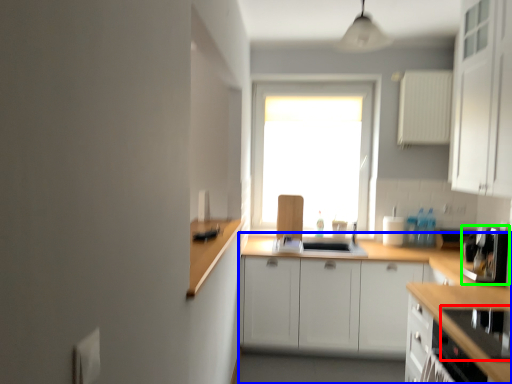
Question: Based on their relative distances, which object is farther from appliance (highlighted by a red box)? Choose from countertop (highlighted by a blue box) and coffee machine (highlighted by a green box).

Choices:
 (A) countertop
 (B) coffee machine

Answer: (A)